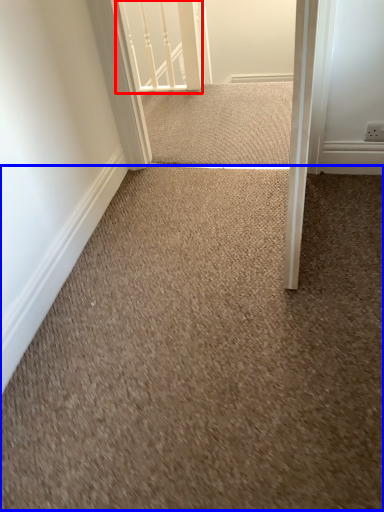
Question: Which of the following is the closest to the observer, rail (highlighted by a red box) or granite (highlighted by a blue box)?

Choices:
 (A) rail
 (B) granite

Answer: (B)